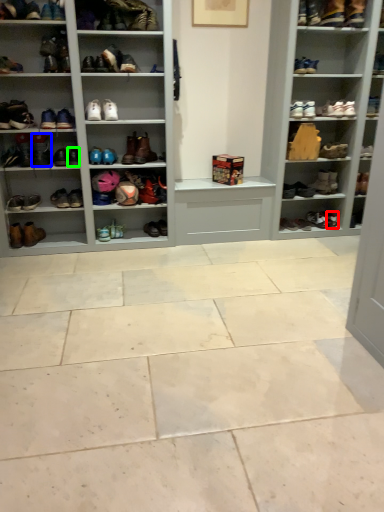
Question: Based on their relative distances, which object is nearer to shoe (highlighted by a red box)? Choose from shoe (highlighted by a blue box) and shoe (highlighted by a green box).

Choices:
 (A) shoe
 (B) shoe

Answer: (B)